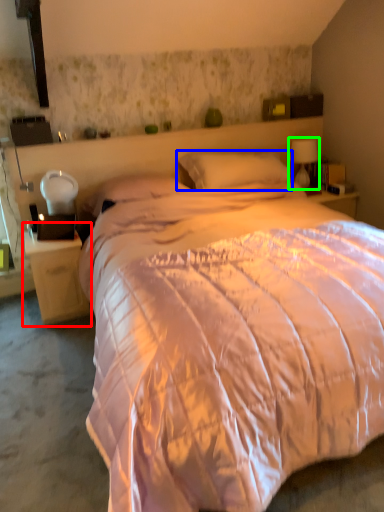
Question: Estimate the real-world distances between objects in this image. Which object is closer to nightstand (highlighted by a red box), pillow (highlighted by a blue box) or table lamp (highlighted by a green box)?

Choices:
 (A) pillow
 (B) table lamp

Answer: (A)